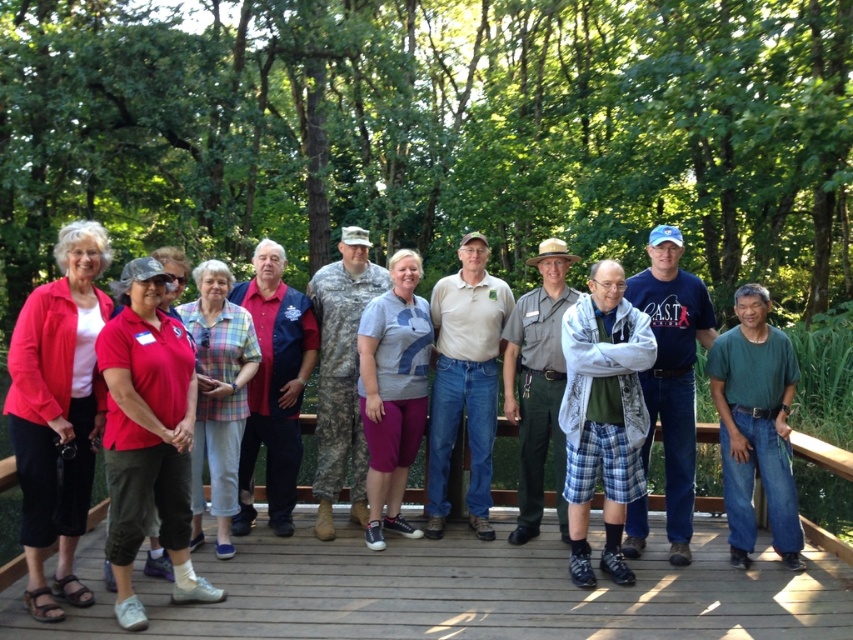
Can you confirm if matte red shirt at center is positioned to the right of khaki uniform at center?

No, matte red shirt at center is not to the right of khaki uniform at center.

Can you confirm if matte red shirt at center is smaller than khaki uniform at center?

No.

Does point (177, 518) come farther from viewer compared to point (558, 481)?

No, (177, 518) is closer to viewer.

The image size is (853, 640). In order to click on matte red shirt at center in this screenshot , I will do `click(148, 435)`.

I want to click on white cotton shirt at center, so click(465, 380).

Between white cotton shirt at center and gray cotton t-shirt at center, which one is positioned lower?

Positioned lower is gray cotton t-shirt at center.

Between point (488, 342) and point (370, 362), which one is positioned in front?

Positioned in front is point (370, 362).

Where is `white cotton shirt at center`? Image resolution: width=853 pixels, height=640 pixels. white cotton shirt at center is located at coordinates (465, 380).

Is matte red jacket at left further to camera compared to blue cotton t-shirt at center?

No.

Does point (38, 589) come farther from viewer compared to point (636, 280)?

No.

Locate an element on the screen. This screenshot has height=640, width=853. matte red jacket at left is located at coordinates (57, 412).